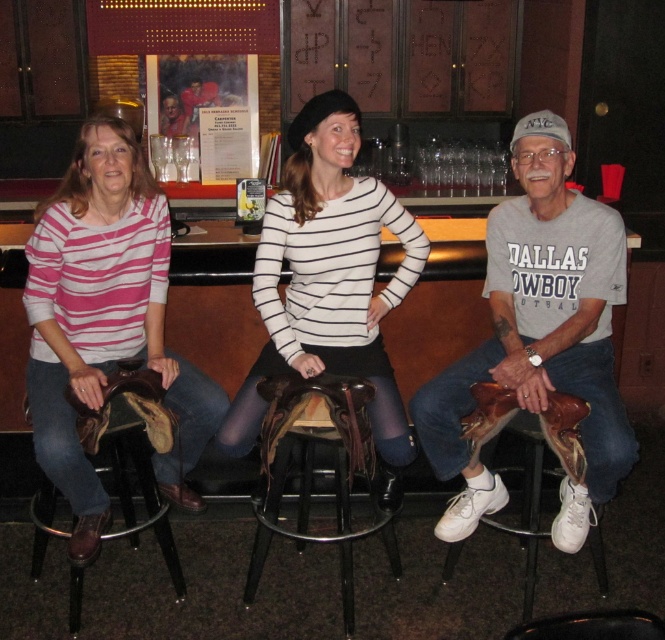
You are standing at the point labeled as point (380, 312) in the image. You want to order a drink from the bar counter. The bar counter is 8 feet away from you. Can you reach the bar counter from your current position?

The distance between point (380, 312) and the viewer is 7.95 feet, which is slightly less than 8 feet. Therefore, you can reach the bar counter from your current position.